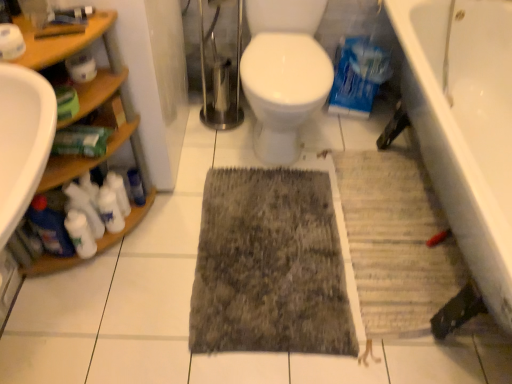
The height and width of the screenshot is (384, 512). In order to click on vacant area that lies between blue glossy bottle at left, the first cleaning product positioned from the left, and dark gray textured rug at center in this screenshot , I will do `click(154, 255)`.